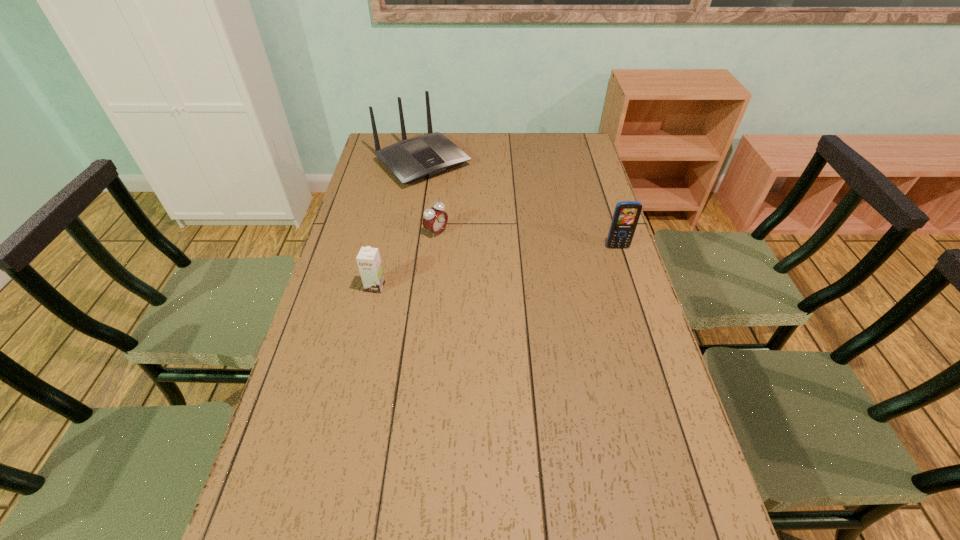
This screenshot has height=540, width=960. Find the location of `vacant space on the desktop that is between the chocolate milk and the rightmost object and is positioned on the clock face of the second farthest object`. vacant space on the desktop that is between the chocolate milk and the rightmost object and is positioned on the clock face of the second farthest object is located at coordinates (496, 267).

Identify the location of free spot on the desktop that is between the chocolate milk and the second tallest object and is positioned on the front-facing side of the tallest object. (531, 261).